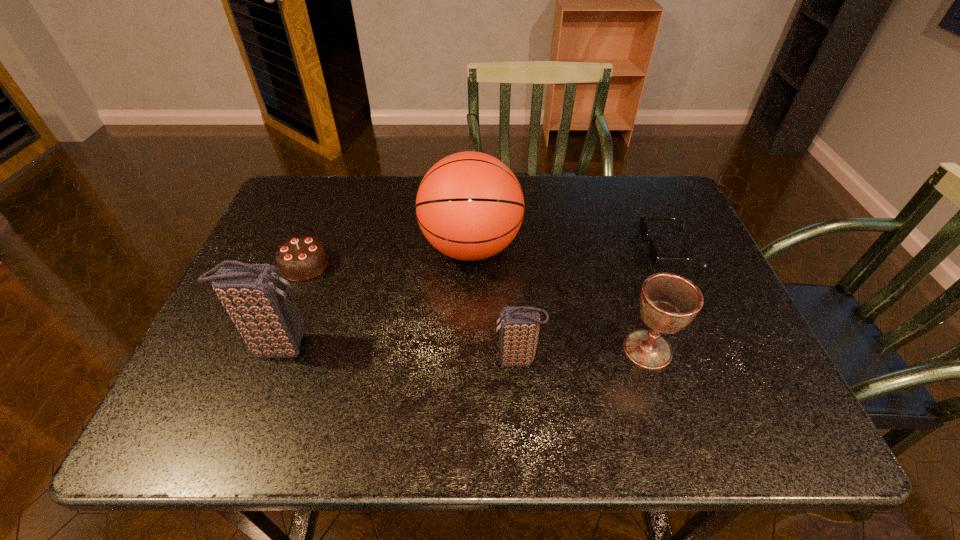
Locate an element on the screen. The height and width of the screenshot is (540, 960). vacant space that satisfies the following two spatial constraints: 1. on the front side of the basketball; 2. with the zip open on the taller clutch bag is located at coordinates (468, 346).

Identify the location of free space in the image that satisfies the following two spatial constraints: 1. with the zip open on the chalice; 2. on the right side of the taller clutch bag. (276, 349).

Identify the location of vacant space that satisfies the following two spatial constraints: 1. on the front side of the chalice; 2. on the right side of the basketball. (468, 349).